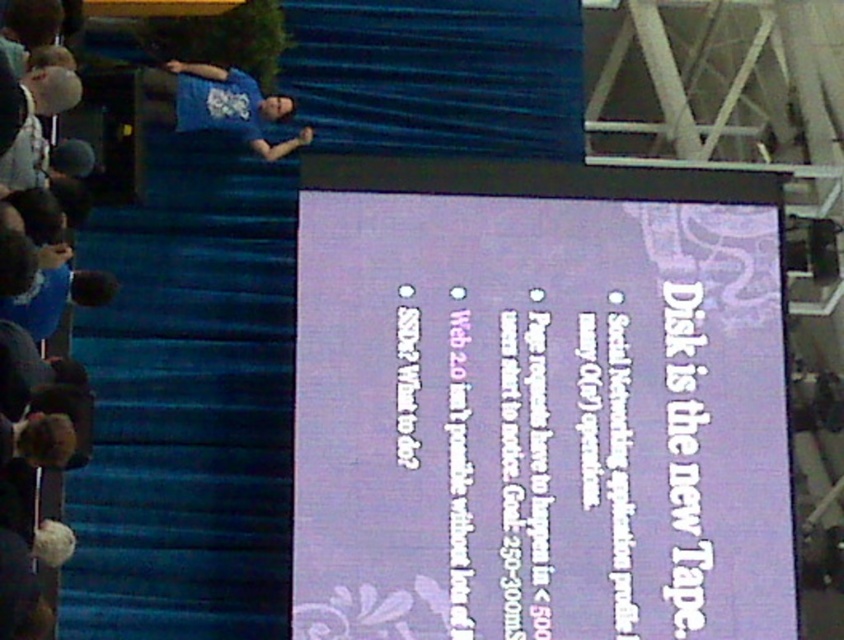
You are an attendee at the conference and want to move from your current position to the exit located at point (287, 99). There is an obstacle at point (778, 456). Can you safely navigate around the obstacle to reach the exit?

Point (778, 456) is in front of point (287, 99), so the obstacle at point (778, 456) is closer to you than the exit at point (287, 99). You will need to navigate around the obstacle before reaching the exit.

You are standing at the front of the conference room where the presentation is happening. There is a point marked at coordinates point (350, 316). If you want to move closer to this point, which direction should you walk? Please answer with a direction like north, south, east, west, front, back, left, right, up, or down.

The point (350, 316) is 199.76 feet away from the camera. Since you are at the front of the conference room, moving towards the back would bring you closer to the point.